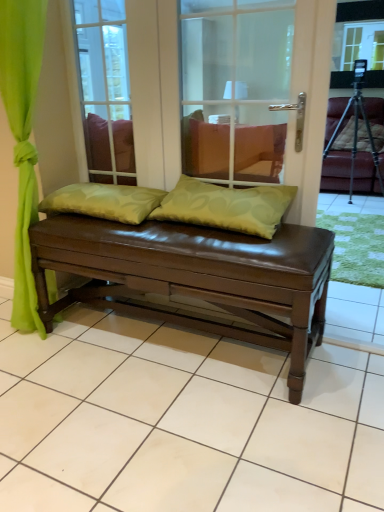
Question: Does transparent glass window screen at upper center have a larger size compared to brown leather bench at center?

Choices:
 (A) no
 (B) yes

Answer: (A)

Question: From a real-world perspective, does transparent glass window screen at upper center sit lower than brown leather bench at center?

Choices:
 (A) no
 (B) yes

Answer: (A)

Question: Does transparent glass window screen at upper center lie behind brown leather bench at center?

Choices:
 (A) yes
 (B) no

Answer: (A)

Question: Is transparent glass window screen at upper center facing away from brown leather bench at center?

Choices:
 (A) no
 (B) yes

Answer: (A)

Question: From the image's perspective, does transparent glass window screen at upper center appear lower than brown leather bench at center?

Choices:
 (A) yes
 (B) no

Answer: (B)

Question: Considering the relative sizes of transparent glass window screen at upper center and brown leather bench at center in the image provided, is transparent glass window screen at upper center thinner than brown leather bench at center?

Choices:
 (A) no
 (B) yes

Answer: (B)

Question: Is green fabric pillow at center, which ranks as the second pillow in right-to-left order, wider than brown leather bench at center?

Choices:
 (A) no
 (B) yes

Answer: (B)

Question: From the image's perspective, is green fabric pillow at center, the 1th pillow viewed from the left, located above brown leather bench at center?

Choices:
 (A) no
 (B) yes

Answer: (A)

Question: Considering the relative sizes of green fabric pillow at center, the 1th pillow viewed from the left, and brown leather bench at center in the image provided, is green fabric pillow at center, the 1th pillow viewed from the left, thinner than brown leather bench at center?

Choices:
 (A) no
 (B) yes

Answer: (A)

Question: Is green fabric pillow at center, which ranks as the second pillow in right-to-left order, located outside brown leather bench at center?

Choices:
 (A) yes
 (B) no

Answer: (A)

Question: Is green fabric pillow at center, the 1th pillow viewed from the left, turned away from brown leather bench at center?

Choices:
 (A) yes
 (B) no

Answer: (B)

Question: Can you confirm if green fabric pillow at center, the 1th pillow viewed from the left, is positioned to the right of brown leather bench at center?

Choices:
 (A) yes
 (B) no

Answer: (B)

Question: Is green fabric pillow at center, the 2th pillow when ordered from left to right, shorter than green fabric pillow at center, the 1th pillow viewed from the left?

Choices:
 (A) no
 (B) yes

Answer: (A)